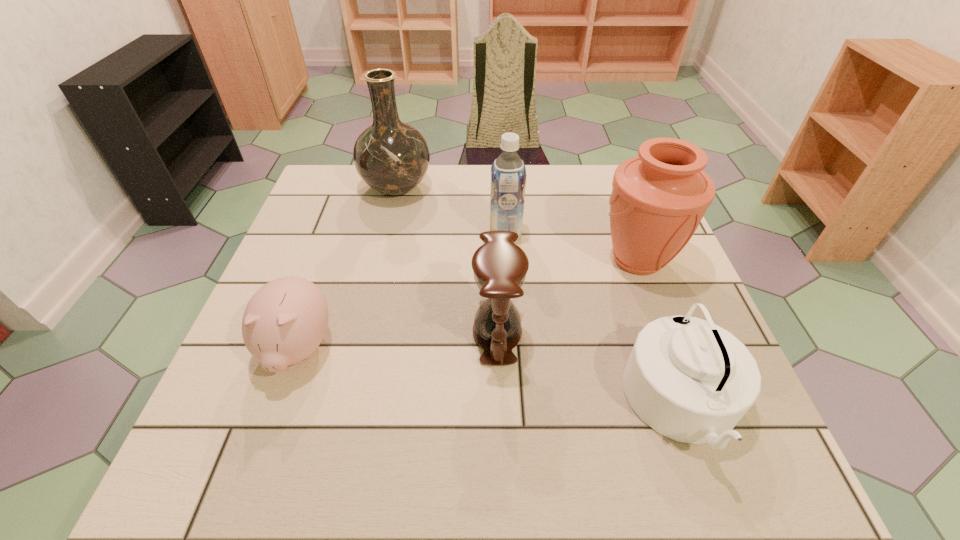
Image resolution: width=960 pixels, height=540 pixels. Find the location of `piggy bank at the left edge`. piggy bank at the left edge is located at coordinates (284, 322).

The image size is (960, 540). I want to click on vase present at the right edge, so click(658, 199).

Identify the location of kettle present at the right edge. This screenshot has height=540, width=960. (690, 380).

In order to click on object located at the far left corner in this screenshot , I will do pos(392,157).

Find the location of `object present at the near right corner`. object present at the near right corner is located at coordinates (690, 380).

Where is `blank area at the far edge`? blank area at the far edge is located at coordinates (431, 209).

In the image, there is a desktop. Where is `vacant area at the near edge`? Image resolution: width=960 pixels, height=540 pixels. vacant area at the near edge is located at coordinates (503, 453).

This screenshot has width=960, height=540. In the image, there is a desktop. Find the location of `vacant space at the left edge`. vacant space at the left edge is located at coordinates [297, 234].

Find the location of a particular element. This screenshot has height=540, width=960. free space at the far left corner of the desktop is located at coordinates (340, 200).

You are a GUI agent. You are given a task and a screenshot of the screen. Output one action in this format:
    pyautogui.click(x=<x>, y=<y>)
    Task: Click on the vacant space at the near left corner of the desktop
    
    Given the screenshot: What is the action you would take?
    pyautogui.click(x=256, y=448)